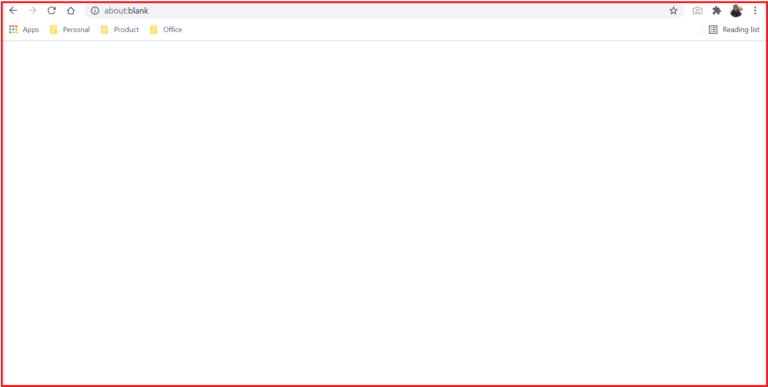
At what (x,y) coordinates should I click in order to perform the action: click on office folder. Please return your answer as a coordinate pair (x, y). This screenshot has width=768, height=387. Looking at the image, I should click on (164, 29).